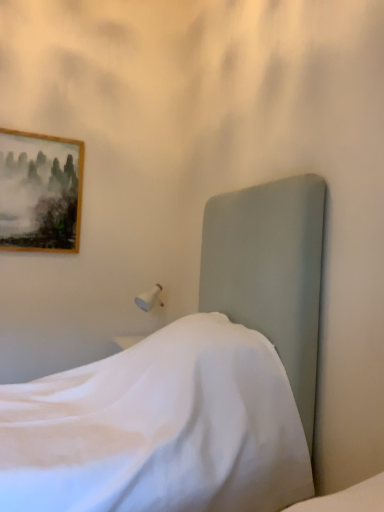
Locate an element on the screen. This screenshot has height=512, width=384. satin white bed at center is located at coordinates (271, 273).

Image resolution: width=384 pixels, height=512 pixels. What do you see at coordinates (271, 273) in the screenshot?
I see `satin white bed at center` at bounding box center [271, 273].

What do you see at coordinates (40, 192) in the screenshot? The height and width of the screenshot is (512, 384). I see `wooden framed painting at upper left` at bounding box center [40, 192].

Identify the location of wooden framed painting at upper left. The height and width of the screenshot is (512, 384). (40, 192).

This screenshot has height=512, width=384. Find the location of `satin white bed at center`. satin white bed at center is located at coordinates (271, 273).

Considering the positions of objects satin white bed at center and wooden framed painting at upper left in the image provided, who is more to the right, satin white bed at center or wooden framed painting at upper left?

satin white bed at center.

Based on the photo, is the depth of satin white bed at center less than that of wooden framed painting at upper left?

Yes.

Which point is more distant from viewer, (350,497) or (57,156)?

The point (57,156) is behind.

From the image's perspective, is satin white bed at center below wooden framed painting at upper left?

Yes, from the image's perspective, satin white bed at center is beneath wooden framed painting at upper left.

From a real-world perspective, who is located higher, satin white bed at center or wooden framed painting at upper left?

wooden framed painting at upper left is physically above.

Considering the relative sizes of satin white bed at center and wooden framed painting at upper left in the image provided, is satin white bed at center wider than wooden framed painting at upper left?

Yes, satin white bed at center is wider than wooden framed painting at upper left.

Is satin white bed at center taller or shorter than wooden framed painting at upper left?

Considering their sizes, satin white bed at center has more height than wooden framed painting at upper left.

Considering the relative sizes of satin white bed at center and wooden framed painting at upper left in the image provided, is satin white bed at center bigger than wooden framed painting at upper left?

Yes.

Looking at this image, is satin white bed at center not inside wooden framed painting at upper left?

Yes, satin white bed at center is located beyond the bounds of wooden framed painting at upper left.

Would you say satin white bed at center is a long distance from wooden framed painting at upper left?

Yes, satin white bed at center and wooden framed painting at upper left are located far from each other.

Is satin white bed at center aimed at wooden framed painting at upper left?

No, satin white bed at center is not aimed at wooden framed painting at upper left.

Can you tell me how much satin white bed at center and wooden framed painting at upper left differ in facing direction?

satin white bed at center and wooden framed painting at upper left are facing 90.9 degrees away from each other.

I want to click on picture frame located on the left of satin white bed at center, so click(40, 192).

Which object is positioned more to the left, wooden framed painting at upper left or satin white bed at center?

From the viewer's perspective, wooden framed painting at upper left appears more on the left side.

Considering the relative positions of wooden framed painting at upper left and satin white bed at center in the image provided, is wooden framed painting at upper left behind satin white bed at center?

That is True.

Which is in front, point (70, 170) or point (310, 298)?

Positioned in front is point (310, 298).

From the image's perspective, between wooden framed painting at upper left and satin white bed at center, which one is located above?

From the image's view, wooden framed painting at upper left is above.

From a real-world perspective, is wooden framed painting at upper left positioned above or below satin white bed at center?

wooden framed painting at upper left is above satin white bed at center.

Considering the relative sizes of wooden framed painting at upper left and satin white bed at center in the image provided, is wooden framed painting at upper left thinner than satin white bed at center?

Yes.

Who is taller, wooden framed painting at upper left or satin white bed at center?

satin white bed at center is taller.

Considering the sizes of objects wooden framed painting at upper left and satin white bed at center in the image provided, who is smaller, wooden framed painting at upper left or satin white bed at center?

wooden framed painting at upper left is smaller.

Can satin white bed at center be found inside wooden framed painting at upper left?

No, satin white bed at center is located outside of wooden framed painting at upper left.

Is wooden framed painting at upper left far away from satin white bed at center?

wooden framed painting at upper left is far away from satin white bed at center.

Is wooden framed painting at upper left oriented towards satin white bed at center?

Yes, wooden framed painting at upper left is oriented towards satin white bed at center.

The width and height of the screenshot is (384, 512). Find the location of `bed in front of the wooden framed painting at upper left`. bed in front of the wooden framed painting at upper left is located at coordinates (271, 273).

Where is `bed in front of the wooden framed painting at upper left`? This screenshot has height=512, width=384. bed in front of the wooden framed painting at upper left is located at coordinates (271, 273).

Identify the location of picture frame lying on the left of satin white bed at center. (40, 192).